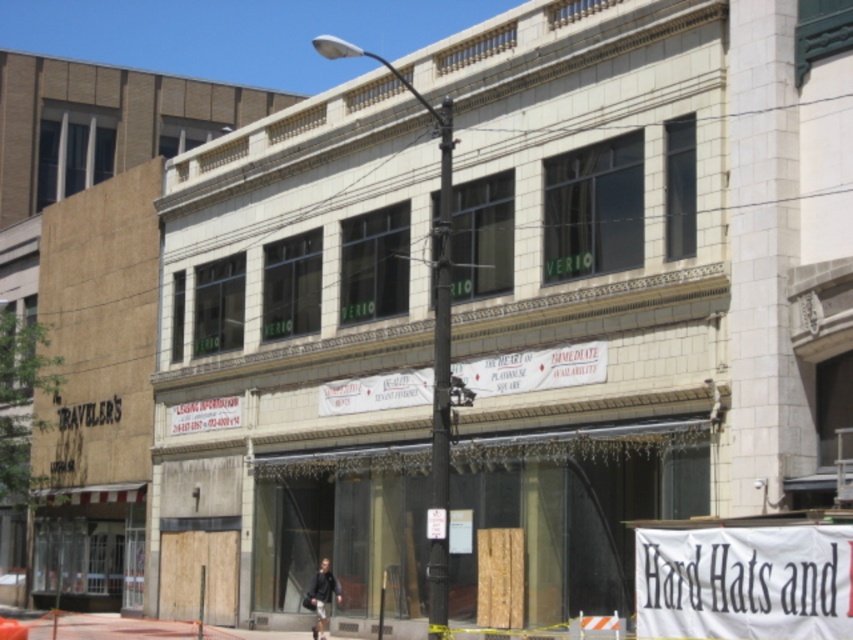
You are a window cleaner standing on the sidewalk in front of the building. You need to clean both the white fabric banner at lower right and the dark gray jacket at center. Which object will require you to climb higher to reach?

The white fabric banner at lower right is taller than the dark gray jacket at center, so you will need to climb higher to reach the white fabric banner at lower right.

You are a pedestrian walking on the street and you see the white fabric banner at lower right and the dark gray jacket at center. Which object is nearer to you?

The white fabric banner at lower right is closer to the viewer than the dark gray jacket at center.